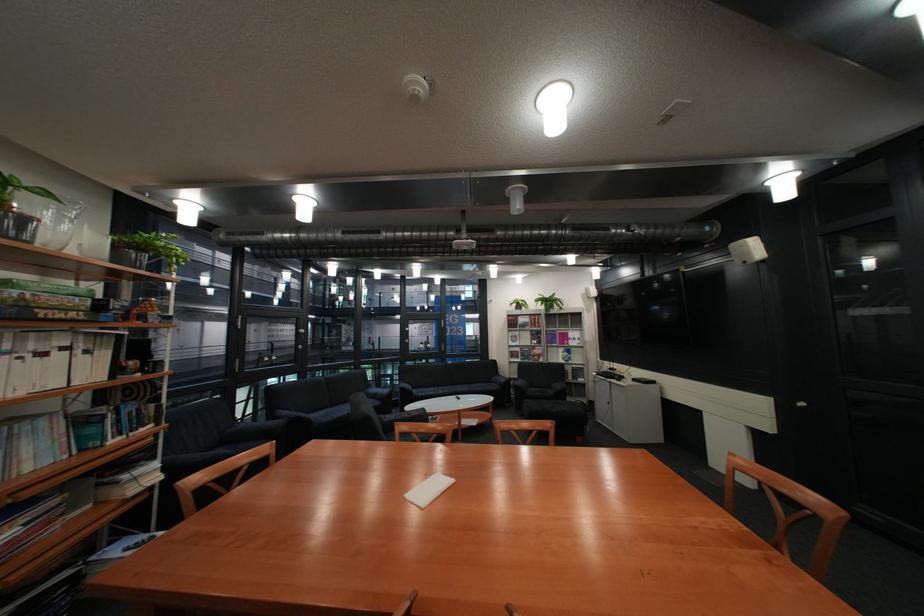
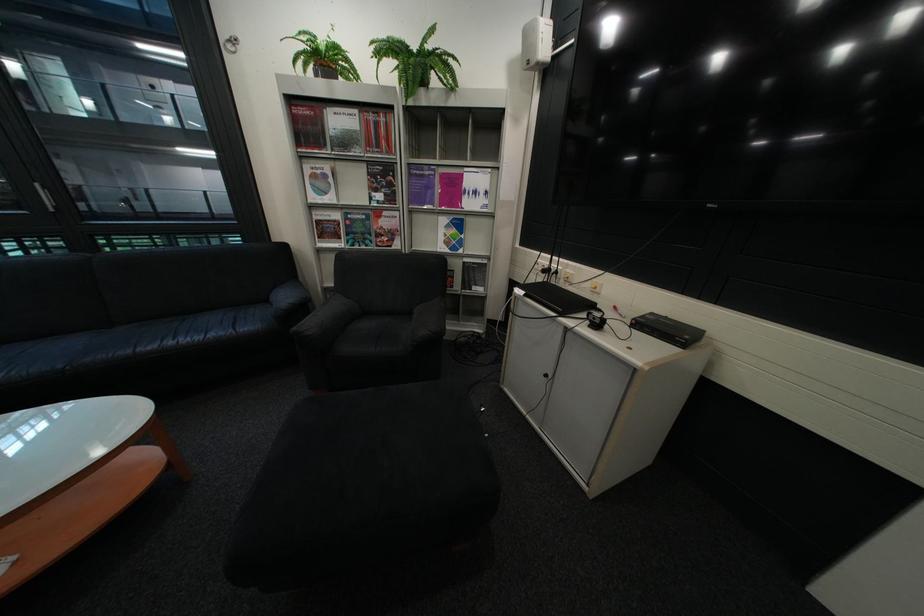
The point at (x=626, y=369) is marked in the first image. Where is the corresponding point in the second image?

(563, 270)